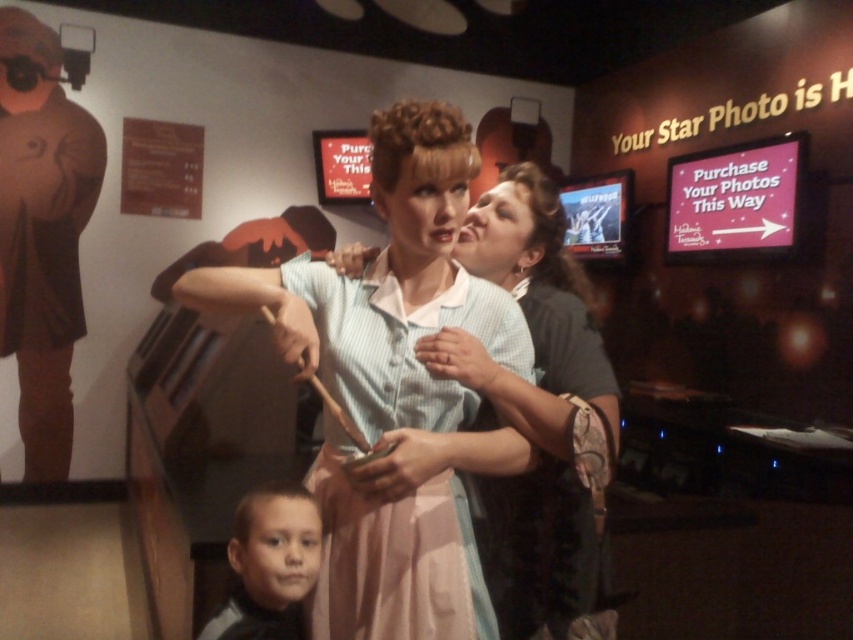
Who is more distant from viewer, (x=442, y=522) or (x=215, y=627)?

The point (x=215, y=627) is more distant.

In the scene shown: Does light blue fabric dress at center have a lesser width compared to smooth skin face at lower left?

No, light blue fabric dress at center is not thinner than smooth skin face at lower left.

Between point (521, 349) and point (268, 561), which one is positioned behind?

The point (521, 349) is more distant.

Identify the location of light blue fabric dress at center. (395, 560).